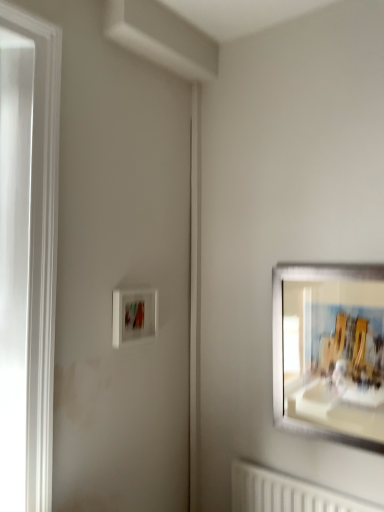
Image resolution: width=384 pixels, height=512 pixels. What do you see at coordinates (330, 351) in the screenshot? I see `matte white picture frame at right, the second picture frame viewed from the left` at bounding box center [330, 351].

Measure the distance between point [365,443] and camera.

The distance of point [365,443] from camera is 1.78 meters.

Where is `matte white picture frame at right, the second picture frame viewed from the left`? matte white picture frame at right, the second picture frame viewed from the left is located at coordinates (330, 351).

The image size is (384, 512). What do you see at coordinates (134, 315) in the screenshot?
I see `white matte picture frame at center-left, arranged as the 2th picture frame when viewed from the right` at bounding box center [134, 315].

The width and height of the screenshot is (384, 512). I want to click on white matte picture frame at center-left, arranged as the 2th picture frame when viewed from the right, so click(134, 315).

What is the approximate height of white matte picture frame at center-left, arranged as the 2th picture frame when viewed from the right?

10.64 inches.

At what (x,y) coordinates should I click in order to perform the action: click on matte white picture frame at right, acting as the 1th picture frame starting from the right. Please return your answer as a coordinate pair (x, y). The width and height of the screenshot is (384, 512). Looking at the image, I should click on (330, 351).

In the image, is white matte picture frame at center-left, arranged as the 2th picture frame when viewed from the right, on the left side or the right side of matte white picture frame at right, the second picture frame viewed from the left?

Clearly, white matte picture frame at center-left, arranged as the 2th picture frame when viewed from the right, is on the left of matte white picture frame at right, the second picture frame viewed from the left, in the image.

Is white matte picture frame at center-left, which appears as the first picture frame when viewed from the left, positioned in front of matte white picture frame at right, the second picture frame viewed from the left?

No, white matte picture frame at center-left, which appears as the first picture frame when viewed from the left, is further to the viewer.

Between point (125, 317) and point (352, 430), which one is positioned in front?

The point (352, 430) is closer to the camera.

From the image's perspective, does white matte picture frame at center-left, which appears as the first picture frame when viewed from the left, appear lower than matte white picture frame at right, acting as the 1th picture frame starting from the right?

No.

From a real-world perspective, is white matte picture frame at center-left, which appears as the first picture frame when viewed from the left, below matte white picture frame at right, the second picture frame viewed from the left?

No, from a real-world perspective, white matte picture frame at center-left, which appears as the first picture frame when viewed from the left, is not under matte white picture frame at right, the second picture frame viewed from the left.

Which object is wider, white matte picture frame at center-left, arranged as the 2th picture frame when viewed from the right, or matte white picture frame at right, acting as the 1th picture frame starting from the right?

Wider between the two is white matte picture frame at center-left, arranged as the 2th picture frame when viewed from the right.

Considering the relative sizes of white matte picture frame at center-left, which appears as the first picture frame when viewed from the left, and matte white picture frame at right, acting as the 1th picture frame starting from the right, in the image provided, is white matte picture frame at center-left, which appears as the first picture frame when viewed from the left, taller than matte white picture frame at right, acting as the 1th picture frame starting from the right,?

Incorrect, the height of white matte picture frame at center-left, which appears as the first picture frame when viewed from the left, is not larger of that of matte white picture frame at right, acting as the 1th picture frame starting from the right.

Considering the sizes of objects white matte picture frame at center-left, arranged as the 2th picture frame when viewed from the right, and matte white picture frame at right, acting as the 1th picture frame starting from the right, in the image provided, who is smaller, white matte picture frame at center-left, arranged as the 2th picture frame when viewed from the right, or matte white picture frame at right, acting as the 1th picture frame starting from the right,?

Smaller between the two is white matte picture frame at center-left, arranged as the 2th picture frame when viewed from the right.

Could matte white picture frame at right, acting as the 1th picture frame starting from the right, be considered to be inside white matte picture frame at center-left, which appears as the first picture frame when viewed from the left?

No, matte white picture frame at right, acting as the 1th picture frame starting from the right, is not surrounded by white matte picture frame at center-left, which appears as the first picture frame when viewed from the left.

Is white matte picture frame at center-left, which appears as the first picture frame when viewed from the left, not near matte white picture frame at right, acting as the 1th picture frame starting from the right?

No.

Could you tell me if white matte picture frame at center-left, which appears as the first picture frame when viewed from the left, is turned towards matte white picture frame at right, acting as the 1th picture frame starting from the right?

No, white matte picture frame at center-left, which appears as the first picture frame when viewed from the left, does not turn towards matte white picture frame at right, acting as the 1th picture frame starting from the right.

Measure the distance from white matte picture frame at center-left, arranged as the 2th picture frame when viewed from the right, to matte white picture frame at right, acting as the 1th picture frame starting from the right.

white matte picture frame at center-left, arranged as the 2th picture frame when viewed from the right, is 32.27 inches from matte white picture frame at right, acting as the 1th picture frame starting from the right.

At what (x,y) coordinates should I click in order to perform the action: click on picture frame that is below the white matte picture frame at center-left, which appears as the first picture frame when viewed from the left (from the image's perspective). Please return your answer as a coordinate pair (x, y). This screenshot has width=384, height=512. Looking at the image, I should click on (330, 351).

Considering the positions of objects matte white picture frame at right, acting as the 1th picture frame starting from the right, and white matte picture frame at center-left, which appears as the first picture frame when viewed from the left, in the image provided, who is more to the right, matte white picture frame at right, acting as the 1th picture frame starting from the right, or white matte picture frame at center-left, which appears as the first picture frame when viewed from the left,?

matte white picture frame at right, acting as the 1th picture frame starting from the right, is more to the right.

Does matte white picture frame at right, the second picture frame viewed from the left, lie in front of white matte picture frame at center-left, which appears as the first picture frame when viewed from the left?

Yes.

Is point (312, 281) positioned before point (156, 331)?

Yes, it is in front of point (156, 331).

From the image's perspective, is matte white picture frame at right, acting as the 1th picture frame starting from the right, located above white matte picture frame at center-left, which appears as the first picture frame when viewed from the left?

Incorrect, from the image's perspective, matte white picture frame at right, acting as the 1th picture frame starting from the right, is lower than white matte picture frame at center-left, which appears as the first picture frame when viewed from the left.

From a real-world perspective, who is located higher, matte white picture frame at right, acting as the 1th picture frame starting from the right, or white matte picture frame at center-left, arranged as the 2th picture frame when viewed from the right?

In real-world perspective, white matte picture frame at center-left, arranged as the 2th picture frame when viewed from the right, is above.

Can you confirm if matte white picture frame at right, the second picture frame viewed from the left, is wider than white matte picture frame at center-left, which appears as the first picture frame when viewed from the left?

No, matte white picture frame at right, the second picture frame viewed from the left, is not wider than white matte picture frame at center-left, which appears as the first picture frame when viewed from the left.

Which of these two, matte white picture frame at right, acting as the 1th picture frame starting from the right, or white matte picture frame at center-left, arranged as the 2th picture frame when viewed from the right, stands shorter?

With less height is white matte picture frame at center-left, arranged as the 2th picture frame when viewed from the right.

Considering the sizes of objects matte white picture frame at right, acting as the 1th picture frame starting from the right, and white matte picture frame at center-left, arranged as the 2th picture frame when viewed from the right, in the image provided, who is bigger, matte white picture frame at right, acting as the 1th picture frame starting from the right, or white matte picture frame at center-left, arranged as the 2th picture frame when viewed from the right,?

With larger size is matte white picture frame at right, acting as the 1th picture frame starting from the right.

Choose the correct answer: Is matte white picture frame at right, acting as the 1th picture frame starting from the right, inside white matte picture frame at center-left, which appears as the first picture frame when viewed from the left, or outside it?

matte white picture frame at right, acting as the 1th picture frame starting from the right, is outside white matte picture frame at center-left, which appears as the first picture frame when viewed from the left.

Is matte white picture frame at right, the second picture frame viewed from the left, positioned far away from white matte picture frame at center-left, arranged as the 2th picture frame when viewed from the right?

That's not correct — matte white picture frame at right, the second picture frame viewed from the left, is a little close to white matte picture frame at center-left, arranged as the 2th picture frame when viewed from the right.

Is matte white picture frame at right, acting as the 1th picture frame starting from the right, positioned with its back to white matte picture frame at center-left, which appears as the first picture frame when viewed from the left?

No, matte white picture frame at right, acting as the 1th picture frame starting from the right, is not facing the opposite direction of white matte picture frame at center-left, which appears as the first picture frame when viewed from the left.

How many degrees apart are the facing directions of matte white picture frame at right, the second picture frame viewed from the left, and white matte picture frame at center-left, arranged as the 2th picture frame when viewed from the right?

matte white picture frame at right, the second picture frame viewed from the left, and white matte picture frame at center-left, arranged as the 2th picture frame when viewed from the right, are facing 89.1 degrees away from each other.

Find the location of a particular element. This screenshot has height=512, width=384. picture frame lying below the white matte picture frame at center-left, which appears as the first picture frame when viewed from the left (from the image's perspective) is located at coordinates [330, 351].

Where is `picture frame that is above the matte white picture frame at right, the second picture frame viewed from the left (from a real-world perspective)`? The image size is (384, 512). picture frame that is above the matte white picture frame at right, the second picture frame viewed from the left (from a real-world perspective) is located at coordinates (134, 315).

Find the location of `picture frame that is on the left side of matte white picture frame at right, acting as the 1th picture frame starting from the right`. picture frame that is on the left side of matte white picture frame at right, acting as the 1th picture frame starting from the right is located at coordinates (134, 315).